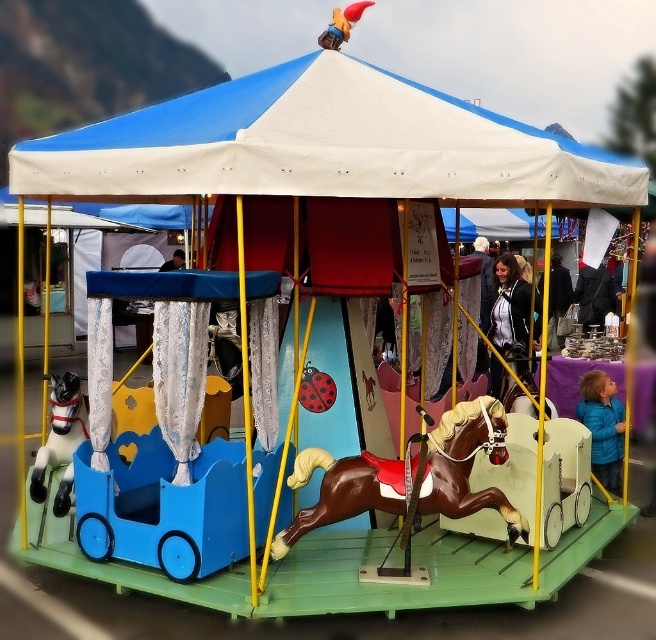
Which of these two, white fabric canopy at upper center or brown glossy horse at center, stands taller?

Standing taller between the two is white fabric canopy at upper center.

Does white fabric canopy at upper center have a greater height compared to brown glossy horse at center?

Yes, white fabric canopy at upper center is taller than brown glossy horse at center.

Is point (340, 116) positioned before point (348, 458)?

Yes.

This screenshot has height=640, width=656. Identify the location of white fabric canopy at upper center. (321, 147).

Who is higher up, white glossy horse at left or black leather jacket at center?

black leather jacket at center

Can you confirm if white glossy horse at left is positioned to the left of black leather jacket at center?

Yes, white glossy horse at left is to the left of black leather jacket at center.

Between point (68, 484) and point (510, 340), which one is positioned in front?

Point (68, 484) is in front.

What are the coordinates of `white glossy horse at left` in the screenshot? It's located at (60, 440).

Does brown glossy horse at center have a smaller size compared to black leather jacket at center?

Correct, brown glossy horse at center occupies less space than black leather jacket at center.

Does point (516, 520) come farther from viewer compared to point (520, 276)?

No, (516, 520) is closer to viewer.

The width and height of the screenshot is (656, 640). In order to click on brown glossy horse at center in this screenshot , I will do `click(464, 465)`.